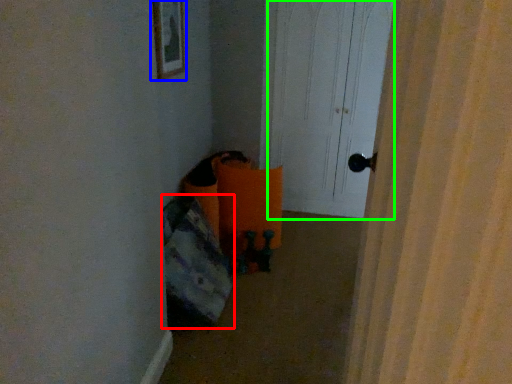
Question: Based on their relative distances, which object is farther from bean bag chair (highlighted by a red box)? Choose from picture frame (highlighted by a blue box) and screen door (highlighted by a green box).

Choices:
 (A) picture frame
 (B) screen door

Answer: (B)